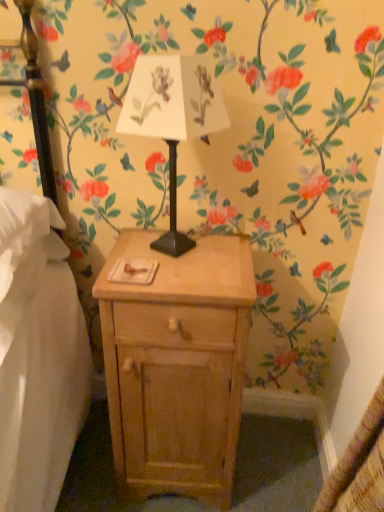
I want to click on free space above light wood nightstand at center (from a real-world perspective), so click(x=187, y=261).